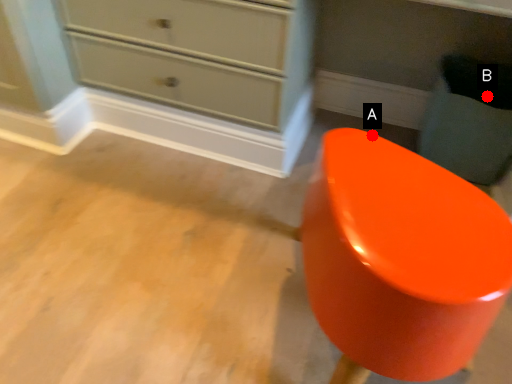
Question: Two points are circled on the image, labeled by A and B beside each circle. Which of the following is the farthest from the observer?

Choices:
 (A) A is further
 (B) B is further

Answer: (B)